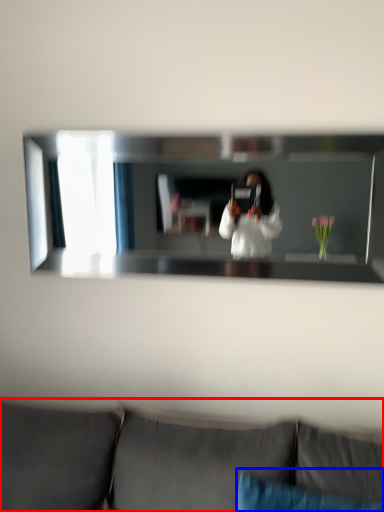
Question: Which object is further to the camera taking this photo, studio couch (highlighted by a red box) or pillow (highlighted by a blue box)?

Choices:
 (A) studio couch
 (B) pillow

Answer: (B)